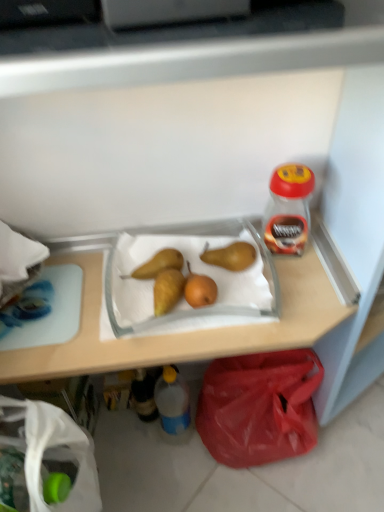
The image size is (384, 512). In order to click on free location in front of brown matte pear at center, which appears as the second pear when viewed from the left in this screenshot , I will do `click(239, 302)`.